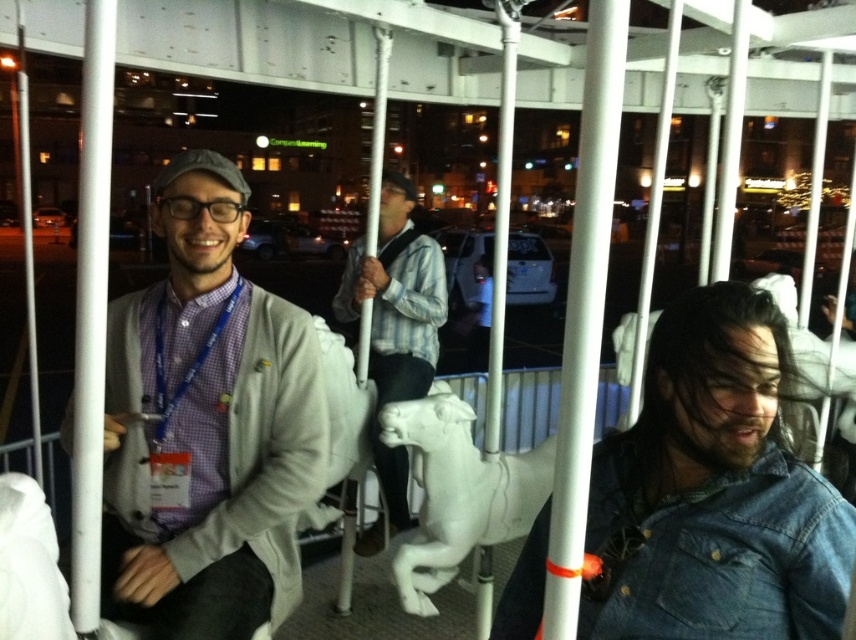
Which is behind, point (186, 602) or point (438, 384)?

The point (438, 384) is more distant.

This screenshot has height=640, width=856. Describe the element at coordinates (207, 426) in the screenshot. I see `matte gray sweater at center` at that location.

Where is `matte gray sweater at center`? Image resolution: width=856 pixels, height=640 pixels. matte gray sweater at center is located at coordinates (207, 426).

Can you confirm if faded denim jacket at lower right is positioned below striped cotton shirt at center?

Correct, faded denim jacket at lower right is located below striped cotton shirt at center.

The height and width of the screenshot is (640, 856). What do you see at coordinates (712, 492) in the screenshot? I see `faded denim jacket at lower right` at bounding box center [712, 492].

Find the location of a particular element. Image resolution: width=856 pixels, height=640 pixels. faded denim jacket at lower right is located at coordinates (712, 492).

Which is above, faded denim jacket at lower right or white matte horse at center?

Positioned higher is faded denim jacket at lower right.

Does faded denim jacket at lower right appear on the left side of white matte horse at center?

Incorrect, faded denim jacket at lower right is not on the left side of white matte horse at center.

At what (x,y) coordinates should I click in order to perform the action: click on faded denim jacket at lower right. Please return your answer as a coordinate pair (x, y). The height and width of the screenshot is (640, 856). Looking at the image, I should click on (712, 492).